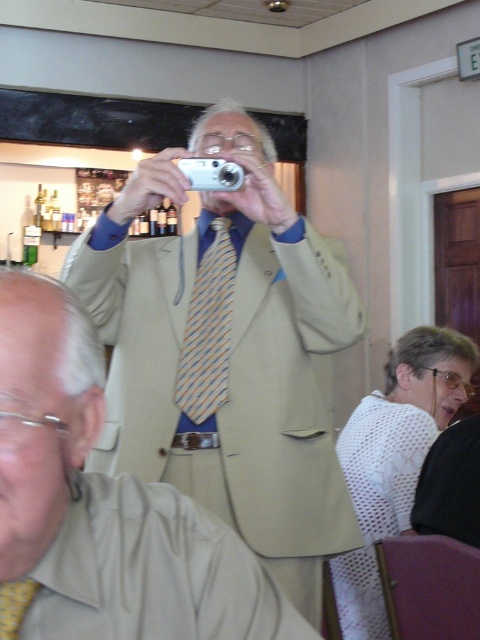
Question: Does yellow striped tie at center have a larger size compared to silver metallic camera at upper center?

Choices:
 (A) no
 (B) yes

Answer: (B)

Question: Which object is closer to the camera taking this photo?

Choices:
 (A) yellowtexturetie at center
 (B) beige fabric suit at center
 (C) silver metallic camera at upper center
 (D) yellow striped tie at center

Answer: (A)

Question: Does beige fabric suit at center lie in front of yellow striped tie at center?

Choices:
 (A) yes
 (B) no

Answer: (A)

Question: Among these objects, which one is nearest to the camera?

Choices:
 (A) silver metallic camera at upper center
 (B) beige fabric suit at center
 (C) yellowtexturetie at center
 (D) yellow striped tie at center

Answer: (C)

Question: Can you confirm if yellow striped tie at center is bigger than silver metallic camera at upper center?

Choices:
 (A) no
 (B) yes

Answer: (B)

Question: Which point is closer to the camera taking this photo?

Choices:
 (A) (16, 616)
 (B) (194, 184)
 (C) (203, 417)
 (D) (120, 442)

Answer: (A)